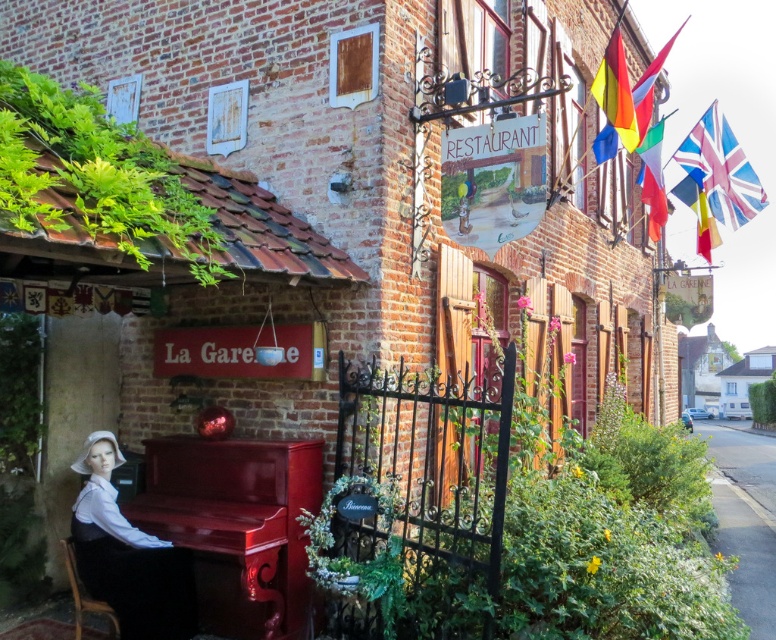
Is the position of wooden chair at lower left more distant than that of blue fabric flag at upper right?

No, it is in front of blue fabric flag at upper right.

What are the coordinates of `wooden chair at lower left` in the screenshot? It's located at (82, 595).

Which is more to the right, smooth white blouse at lower left or union jack fabric flag at upper right?

Positioned to the right is union jack fabric flag at upper right.

Locate an element on the screen. Image resolution: width=776 pixels, height=640 pixels. smooth white blouse at lower left is located at coordinates (127, 556).

Which is in front, point (88, 515) or point (75, 624)?

Positioned in front is point (88, 515).

I want to click on smooth white blouse at lower left, so click(127, 556).

At what (x,y) coordinates should I click in order to perform the action: click on smooth white blouse at lower left. Please return your answer as a coordinate pair (x, y). Looking at the image, I should click on click(127, 556).

At what (x,y) coordinates should I click in order to perform the action: click on smooth white blouse at lower left. Please return your answer as a coordinate pair (x, y). This screenshot has height=640, width=776. Looking at the image, I should click on (127, 556).